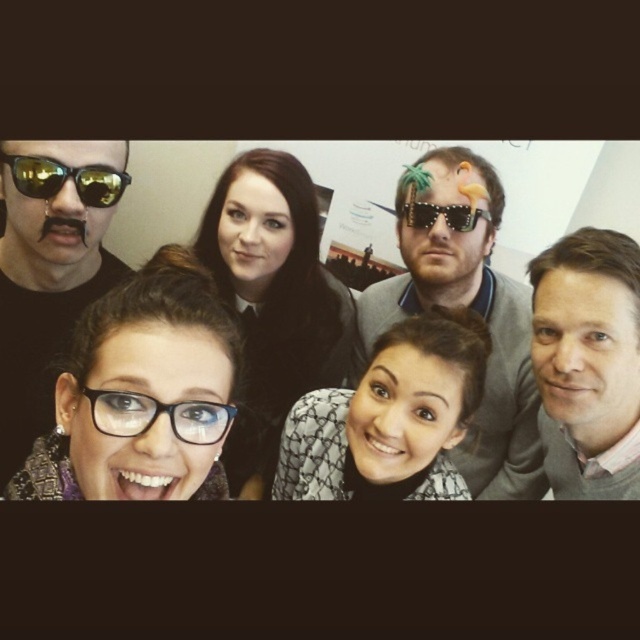
Is patterned fabric hair at center to the left of gray sweater at upper right from the viewer's perspective?

Indeed, patterned fabric hair at center is positioned on the left side of gray sweater at upper right.

Is point (365, 410) positioned behind point (602, 428)?

That is False.

Locate an element on the screen. patterned fabric hair at center is located at coordinates (388, 417).

Does black matte sunglasses at upper left come in front of gray sweater at upper right?

Yes, black matte sunglasses at upper left is closer to the viewer.

Between black matte sunglasses at upper left and gray sweater at upper right, which one is positioned lower?

gray sweater at upper right is lower down.

Where is `black matte sunglasses at upper left`? The height and width of the screenshot is (640, 640). black matte sunglasses at upper left is located at coordinates click(x=49, y=269).

Find the location of a particular element. This screenshot has width=640, height=640. black matte sunglasses at upper left is located at coordinates (49, 269).

Between point (544, 432) and point (452, 221), which one is positioned behind?

The point (544, 432) is behind.

Which is in front, point (637, 353) or point (474, 225)?

Point (637, 353)

Where is `gray sweater at upper right`? gray sweater at upper right is located at coordinates (588, 362).